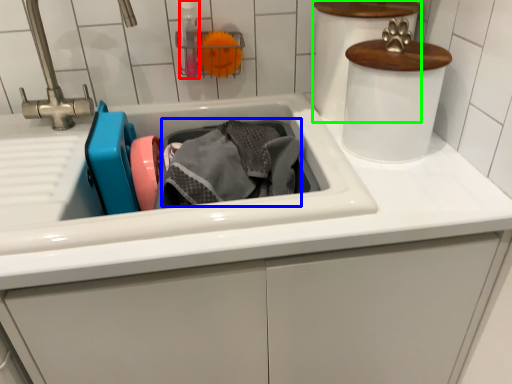
Question: Based on their relative distances, which object is farther from bottle (highlighted by a red box)? Choose from material (highlighted by a blue box) and appliance (highlighted by a green box).

Choices:
 (A) material
 (B) appliance

Answer: (B)